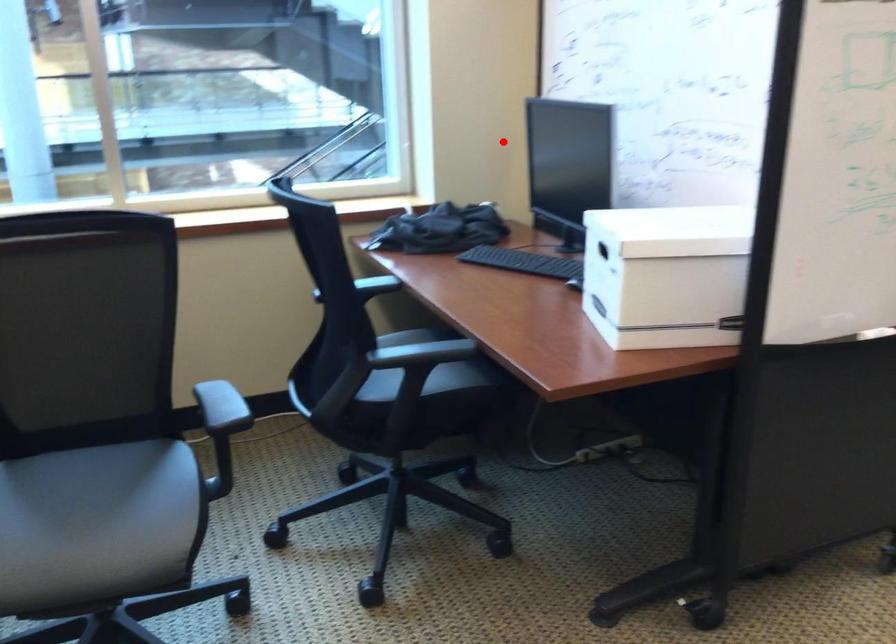
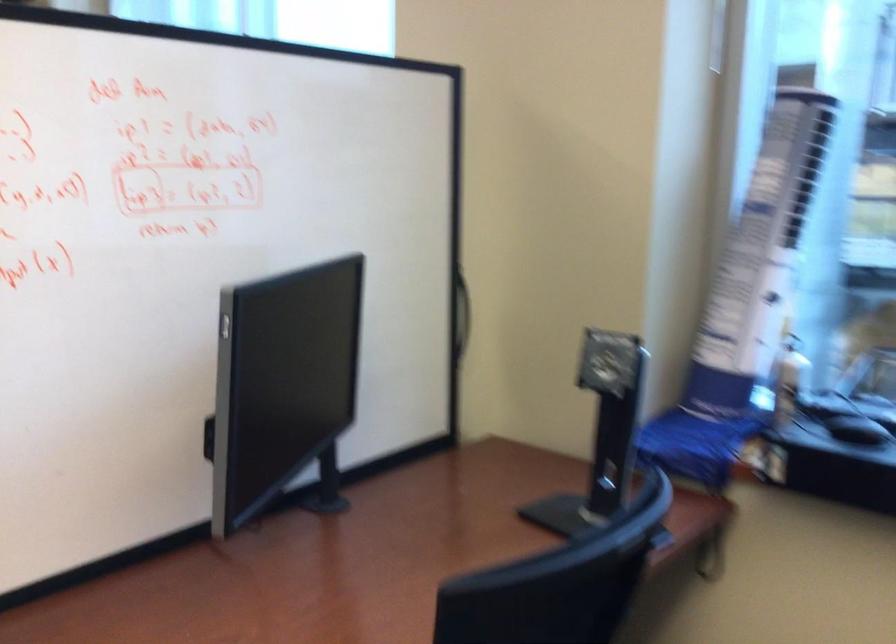
Question: I am providing you with two images of the same scene from different viewpoints. Given a red point in image1, look at the same physical point in image2. Is it:

Choices:
 (A) Closer to the viewpoint
 (B) Farther from the viewpoint

Answer: (A)